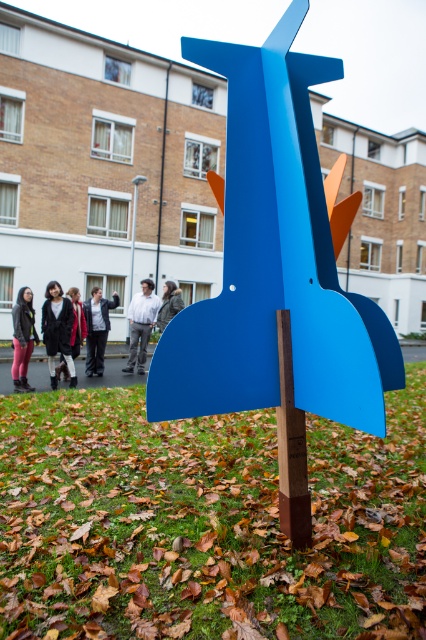
Image resolution: width=426 pixels, height=640 pixels. Describe the element at coordinates (206, 524) in the screenshot. I see `green grass at center` at that location.

Who is more distant from viewer, (316,576) or (97,328)?

The point (97,328) is more distant.

At what (x,y) coordinates should I click in order to perform the action: click on green grass at center. Please return your answer as a coordinate pair (x, y). Image resolution: width=426 pixels, height=640 pixels. Looking at the image, I should click on (206, 524).

Consider the image. Does green grass at center appear under light gray fabric jacket at center?

Yes.

Which is behind, point (135, 396) or point (155, 300)?

Positioned behind is point (155, 300).

Measure the distance between point (391,540) and camera.

9.46 feet

Where is `green grass at center`? The height and width of the screenshot is (640, 426). green grass at center is located at coordinates (206, 524).

Can you confirm if green grass at center is taller than matte blue rocket at center?

No, green grass at center is not taller than matte blue rocket at center.

Describe the element at coordinates (206, 524) in the screenshot. I see `green grass at center` at that location.

Which is in front, point (109, 497) or point (170, 326)?

Point (170, 326)

Where is `green grass at center`? Image resolution: width=426 pixels, height=640 pixels. green grass at center is located at coordinates (206, 524).